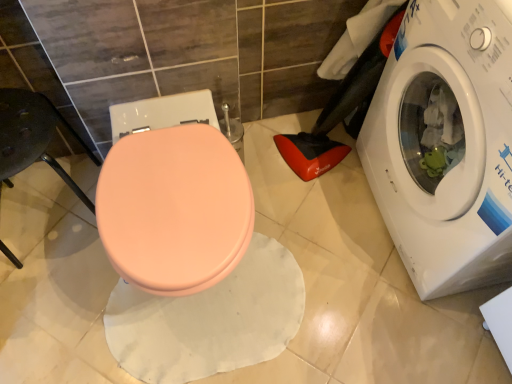
Where is `vacant space to the left of white glossy washing machine at right`? Image resolution: width=512 pixels, height=384 pixels. vacant space to the left of white glossy washing machine at right is located at coordinates (317, 220).